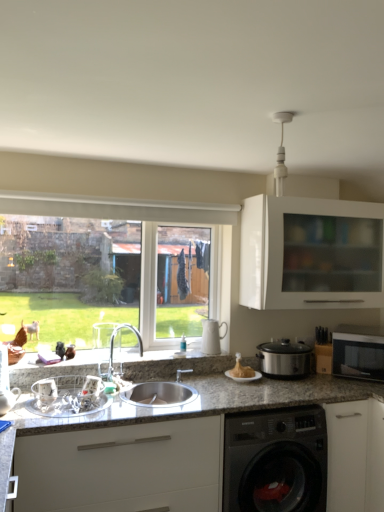
Question: Can you confirm if metallic silver dish rack at sink, which is counted as the second appliance, starting from the left, is shorter than silver metallic faucet at center?

Choices:
 (A) yes
 (B) no

Answer: (A)

Question: Could you tell me if metallic silver dish rack at sink, positioned as the 1th appliance in front-to-back order, is turned towards silver metallic faucet at center?

Choices:
 (A) no
 (B) yes

Answer: (A)

Question: Is metallic silver dish rack at sink, positioned as the 1th appliance in front-to-back order, next to silver metallic faucet at center?

Choices:
 (A) no
 (B) yes

Answer: (A)

Question: Does metallic silver dish rack at sink, positioned as the 1th appliance in front-to-back order, have a lesser width compared to silver metallic faucet at center?

Choices:
 (A) no
 (B) yes

Answer: (A)

Question: Is metallic silver dish rack at sink, positioned as the 1th appliance in front-to-back order, outside of silver metallic faucet at center?

Choices:
 (A) no
 (B) yes

Answer: (B)

Question: Considering the positions of satin silver slow cooker at right, the 3th appliance in the left-to-right sequence, and golden crispy turkey at center in the image, is satin silver slow cooker at right, the 3th appliance in the left-to-right sequence, bigger or smaller than golden crispy turkey at center?

Choices:
 (A) small
 (B) big

Answer: (B)

Question: From the image's perspective, is satin silver slow cooker at right, placed as the 1th appliance when sorted from right to left, above or below golden crispy turkey at center?

Choices:
 (A) below
 (B) above

Answer: (B)

Question: Is point pyautogui.click(x=284, y=361) positioned closer to the camera than point pyautogui.click(x=246, y=374)?

Choices:
 (A) closer
 (B) farther

Answer: (A)

Question: Is satin silver slow cooker at right, placed as the third appliance when sorted from front to back, situated inside golden crispy turkey at center or outside?

Choices:
 (A) inside
 (B) outside

Answer: (B)

Question: Is granite/stone countertop at lower center spatially inside metallic silver sink at lower left, which ranks as the 3th appliance in right-to-left order, or outside of it?

Choices:
 (A) inside
 (B) outside

Answer: (B)

Question: Is granite/stone countertop at lower center in front of or behind metallic silver sink at lower left, the 1th appliance viewed from the left, in the image?

Choices:
 (A) front
 (B) behind

Answer: (A)

Question: Based on their sizes in the image, would you say granite/stone countertop at lower center is bigger or smaller than metallic silver sink at lower left, which ranks as the 3th appliance in right-to-left order?

Choices:
 (A) small
 (B) big

Answer: (B)

Question: Is point (355, 428) closer or farther from the camera than point (9, 398)?

Choices:
 (A) farther
 (B) closer

Answer: (A)

Question: In terms of width, does metallic silver dish rack at sink, positioned as the 1th appliance in front-to-back order, look wider or thinner when compared to granite/stone countertop at lower center?

Choices:
 (A) thin
 (B) wide

Answer: (A)

Question: Looking at the image, does metallic silver dish rack at sink, which is counted as the second appliance, starting from the left, seem bigger or smaller compared to granite/stone countertop at lower center?

Choices:
 (A) big
 (B) small

Answer: (B)